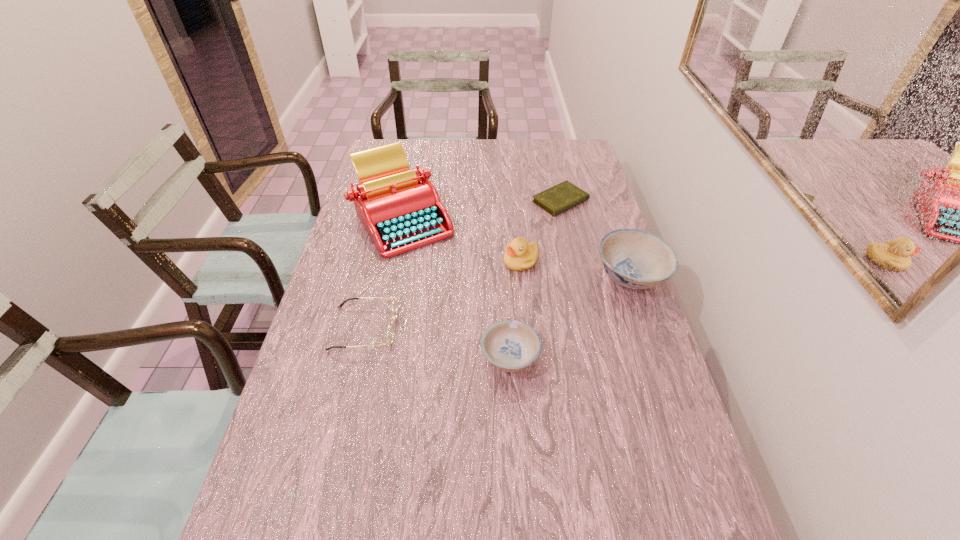
I want to click on blank space located 0.110m on the typing side of the tallest object, so click(390, 285).

The image size is (960, 540). Find the location of `vacant area situated on the left of the diary`. vacant area situated on the left of the diary is located at coordinates (451, 201).

This screenshot has height=540, width=960. Identify the location of vacant space situated 0.050m on the lenses of the spectacles. 415,328.

This screenshot has height=540, width=960. Identify the location of free space located 0.210m on the front-facing side of the duckling. (435, 261).

The height and width of the screenshot is (540, 960). I want to click on vacant space located on the front-facing side of the duckling, so click(x=465, y=261).

Locate an element on the screen. This screenshot has height=540, width=960. vacant space located on the front-facing side of the duckling is located at coordinates (432, 261).

This screenshot has width=960, height=540. I want to click on typewriter situated at the left edge, so click(x=399, y=207).

Locate an element on the screen. Image resolution: width=960 pixels, height=540 pixels. spectacles that is positioned at the left edge is located at coordinates (394, 306).

The height and width of the screenshot is (540, 960). What are the coordinates of `bowl at the right edge` in the screenshot? It's located at (637, 259).

Where is `diary that is positioned at the right edge`? The image size is (960, 540). diary that is positioned at the right edge is located at coordinates (563, 196).